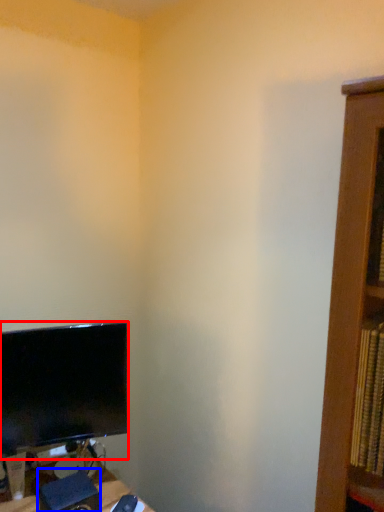
Question: Among these objects, which one is nearest to the camera, computer monitor (highlighted by a red box) or speaker (highlighted by a blue box)?

Choices:
 (A) computer monitor
 (B) speaker

Answer: (B)